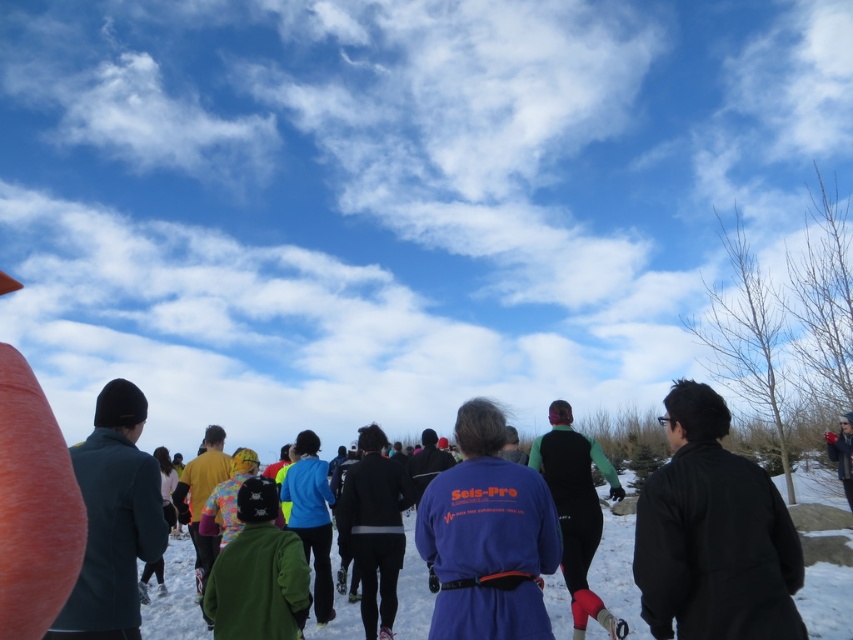
You are a photographer trying to capture a photo of the blue fleece jacket at center without including the black matte jacket at right in the frame. Based on their positions, is this possible?

The black matte jacket at right is in front of the blue fleece jacket at center, so it would block the view. Therefore, you cannot capture the blue fleece jacket at center without including the black matte jacket at right in the frame.

You are a photographer trying to capture a group photo of the black matte jacket at right and the blue fleece jacket at center. The camera you are using has a maximum focus range of 4 feet. Can you fit both subjects within the camera frame without moving either of them?

The black matte jacket at right and the blue fleece jacket at center are 3.82 feet apart from each other, which is within the camera maximum focus range of 4 feet. Therefore, you can fit both subjects within the camera frame without moving them.